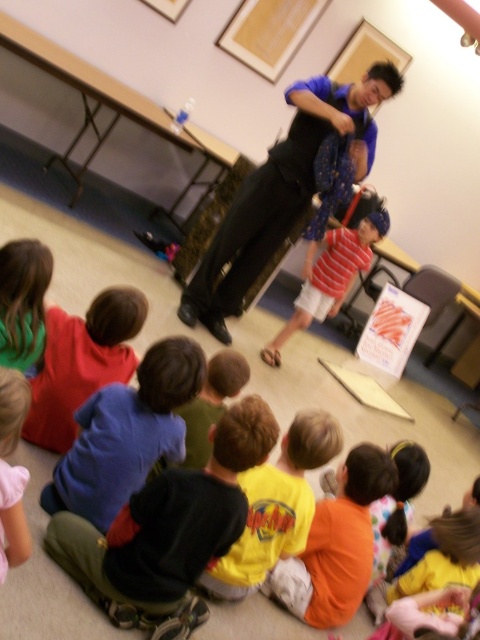
Who is lower down, yellow t-shirt at lower center or yellow cotton shirt at center?

Positioned lower is yellow t-shirt at lower center.

Locate an element on the screen. The height and width of the screenshot is (640, 480). yellow t-shirt at lower center is located at coordinates (336, 545).

Is striped cotton shirt at center to the left of soft pink shirt at lower left from the viewer's perspective?

Incorrect, striped cotton shirt at center is not on the left side of soft pink shirt at lower left.

Is point (312, 252) less distant than point (16, 506)?

No, (312, 252) is behind (16, 506).

I want to click on striped cotton shirt at center, so click(x=330, y=276).

In the scene shown: Is yellow t-shirt at lower center smaller than green hair at lower left?

No, yellow t-shirt at lower center is not smaller than green hair at lower left.

Can you confirm if yellow t-shirt at lower center is thinner than green hair at lower left?

No.

Is point (344, 486) positioned before point (28, 296)?

No, it is not.

Find the location of a particular element. The width and height of the screenshot is (480, 640). yellow t-shirt at lower center is located at coordinates (336, 545).